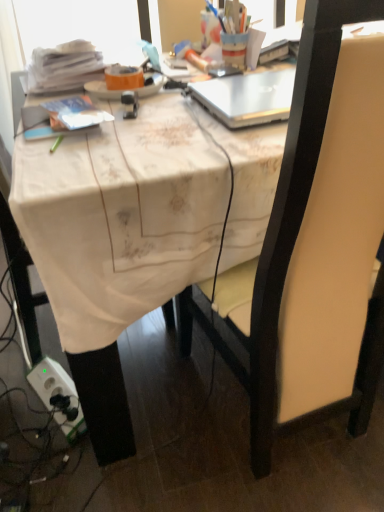
Question: Would you say white fabric-covered desk at center is to the left or to the right of silver metallic laptop at upper center in the picture?

Choices:
 (A) left
 (B) right

Answer: (B)

Question: From a real-world perspective, relative to silver metallic laptop at upper center, is white fabric-covered desk at center vertically above or below?

Choices:
 (A) above
 (B) below

Answer: (B)

Question: Estimate the real-world distances between objects in this image. Which object is farther from the silver metallic laptop at upper center?

Choices:
 (A) matte black chair at center
 (B) orange matte plate at upper center
 (C) white fabric-covered desk at center

Answer: (A)

Question: Estimate the real-world distances between objects in this image. Which object is farther from the silver metallic laptop at upper center?

Choices:
 (A) orange matte plate at upper center
 (B) matte black chair at center
 (C) white fabric-covered desk at center

Answer: (B)